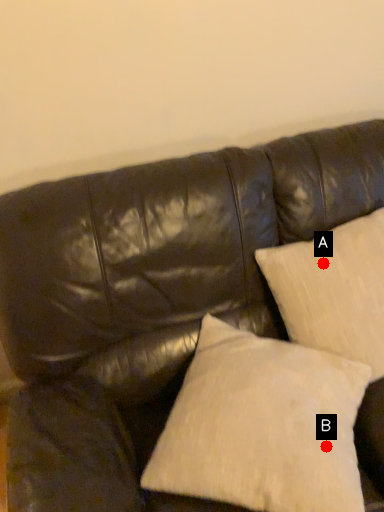
Question: Two points are circled on the image, labeled by A and B beside each circle. Which of the following is the farthest from the observer?

Choices:
 (A) A is further
 (B) B is further

Answer: (A)